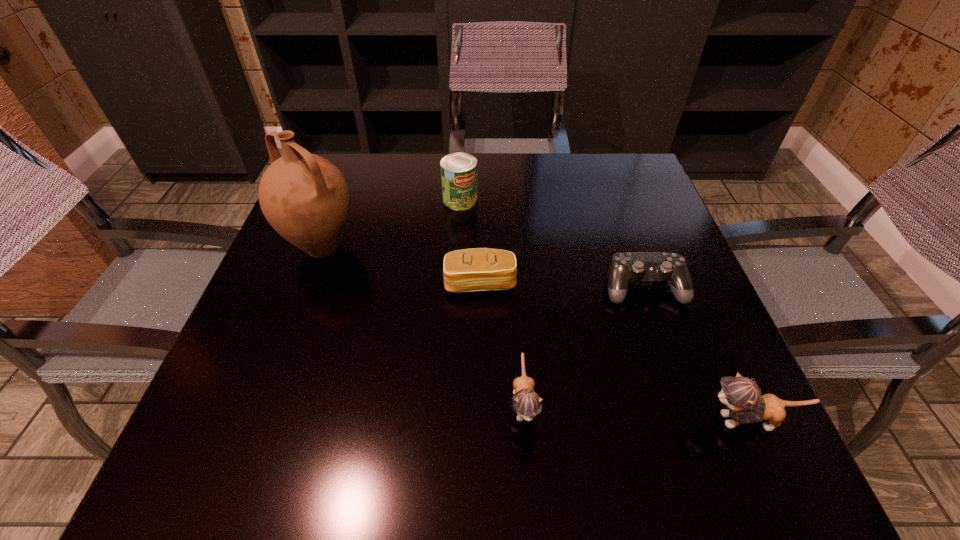
The kittens are evenly distributed in the image. To maintain this, where would you place another kitten on the left? Please point to a free space. Please provide its 2D coordinates. Your answer should be formatted as a tuple, i.e. [(x, y)], where the tuple contains the x and y coordinates of a point satisfying the conditions above.

[(310, 387)]